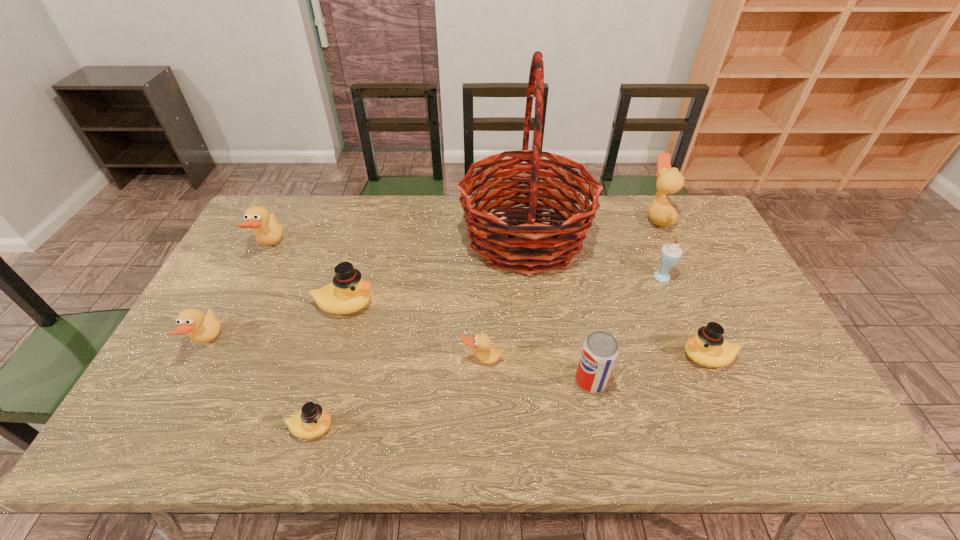
The height and width of the screenshot is (540, 960). In order to click on object that is the second nearest to the milkshake in this screenshot , I will do `click(669, 180)`.

Locate an element on the screen. This screenshot has width=960, height=540. object that stands as the third closest to the second biggest tan duck is located at coordinates [x=311, y=422].

The height and width of the screenshot is (540, 960). What are the coordinates of `duck that is the sixth closest one to the biggest tan duck` in the screenshot? It's located at (200, 329).

Where is `duck that is the closest one to the third duck from right to left`? duck that is the closest one to the third duck from right to left is located at coordinates (348, 293).

The image size is (960, 540). I want to click on tan duck that stands as the closest to the second tan duck from right to left, so click(x=200, y=329).

Identify which tan duck is located as the second nearest to the farthest yellow duck. Please provide its 2D coordinates. Your answer should be formatted as a tuple, i.e. [(x, y)], where the tuple contains the x and y coordinates of a point satisfying the conditions above.

[(200, 329)]

Locate which yellow duck ranks third in proximity to the soda. Please provide its 2D coordinates. Your answer should be formatted as a tuple, i.e. [(x, y)], where the tuple contains the x and y coordinates of a point satisfying the conditions above.

[(311, 422)]

Identify the location of yellow duck that is the closest one to the farthest yellow duck. This screenshot has width=960, height=540. (311, 422).

I want to click on vacant region that satisfies the following two spatial constraints: 1. on the beak of the third smallest tan duck; 2. on the back side of the soda, so click(202, 381).